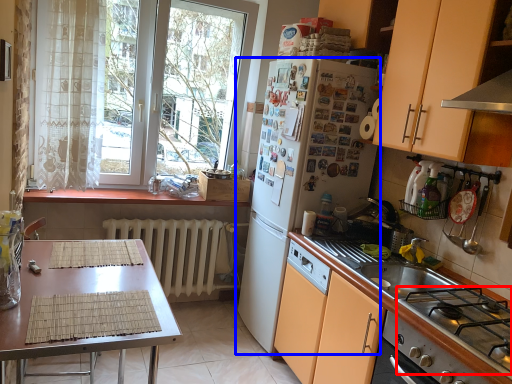
Question: Which object is closer to the camera taking this photo, gas stove (highlighted by a red box) or refrigerator (highlighted by a blue box)?

Choices:
 (A) gas stove
 (B) refrigerator

Answer: (A)